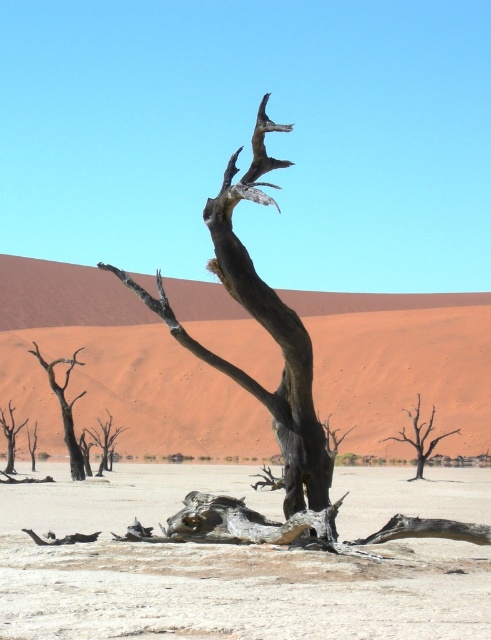
Does smooth sand dune at center have a larger size compared to brown rough tree at left?

Indeed, smooth sand dune at center has a larger size compared to brown rough tree at left.

Is smooth sand dune at center shorter than brown rough tree at left?

No, smooth sand dune at center is not shorter than brown rough tree at left.

Does point (156, 380) come behind point (0, 412)?

Yes.

Image resolution: width=491 pixels, height=640 pixels. I want to click on smooth sand dune at center, so click(115, 365).

Which is in front, point (275, 316) or point (427, 429)?

Point (275, 316) is in front.

Is the position of dark gray bark tree at center more distant than that of brown textured tree at center?

No, dark gray bark tree at center is closer to the viewer.

Measure the distance between dark gray bark tree at center and camera.

dark gray bark tree at center is 8.74 meters away from camera.

Image resolution: width=491 pixels, height=640 pixels. I want to click on dark gray bark tree at center, so click(x=264, y=326).

Is brown rough tree at left to the left of brown rough tree trunk at lower left from the viewer's perspective?

No, brown rough tree at left is not to the left of brown rough tree trunk at lower left.

The image size is (491, 640). What do you see at coordinates (9, 435) in the screenshot?
I see `brown rough tree at left` at bounding box center [9, 435].

Find the location of a particular element. This screenshot has width=491, height=640. brown rough tree at left is located at coordinates (9, 435).